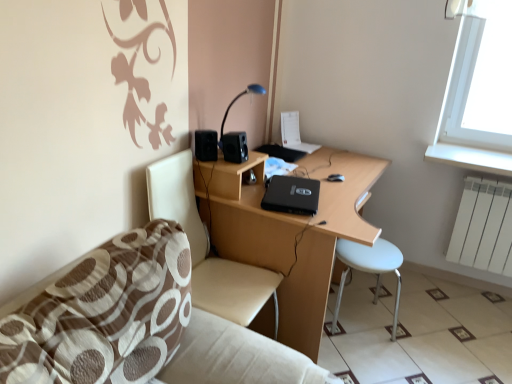
Locate an element on the screen. free space in front of white plastic stool at lower right is located at coordinates (377, 362).